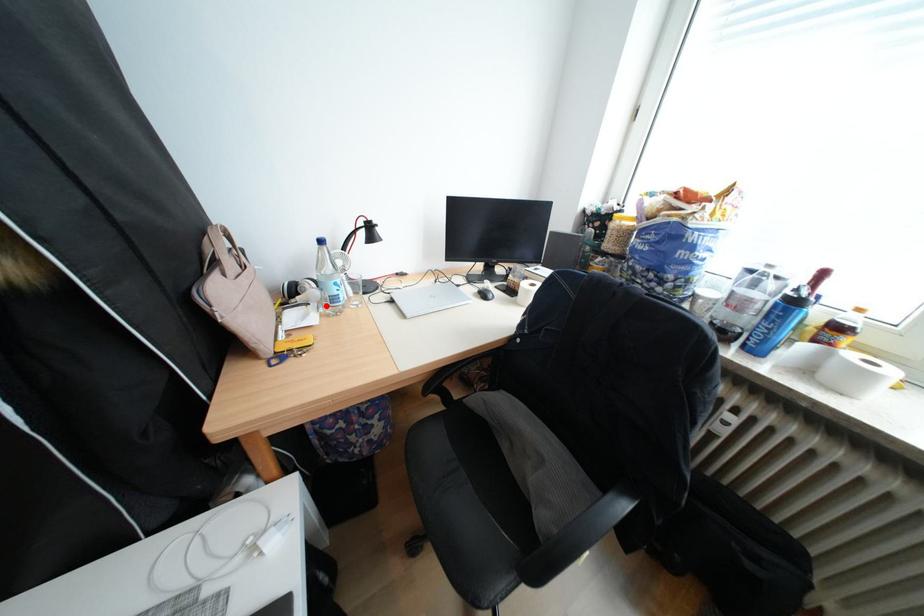
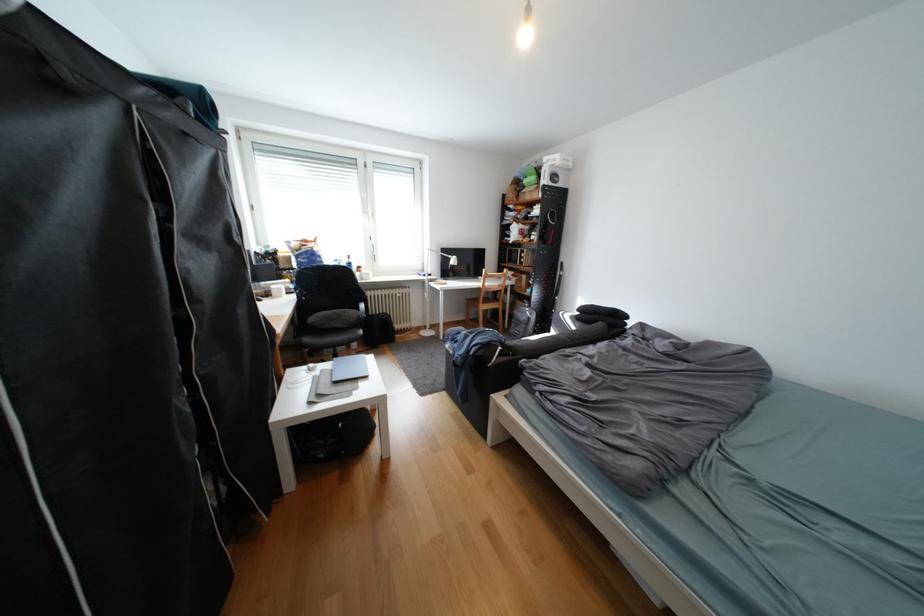
Question: I am providing you with two images of the same scene from different viewpoints. A red point is marked on the first image. Can you still see the location of the red point in image 2?

Choices:
 (A) Yes
 (B) No

Answer: (B)